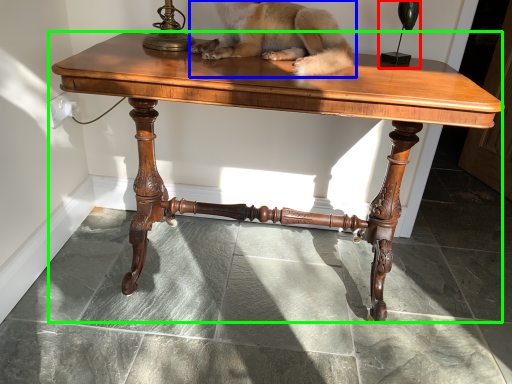
Question: Which is nearer to the candle holder (highlighted by a red box)? dog (highlighted by a blue box) or table (highlighted by a green box).

Choices:
 (A) dog
 (B) table

Answer: (A)